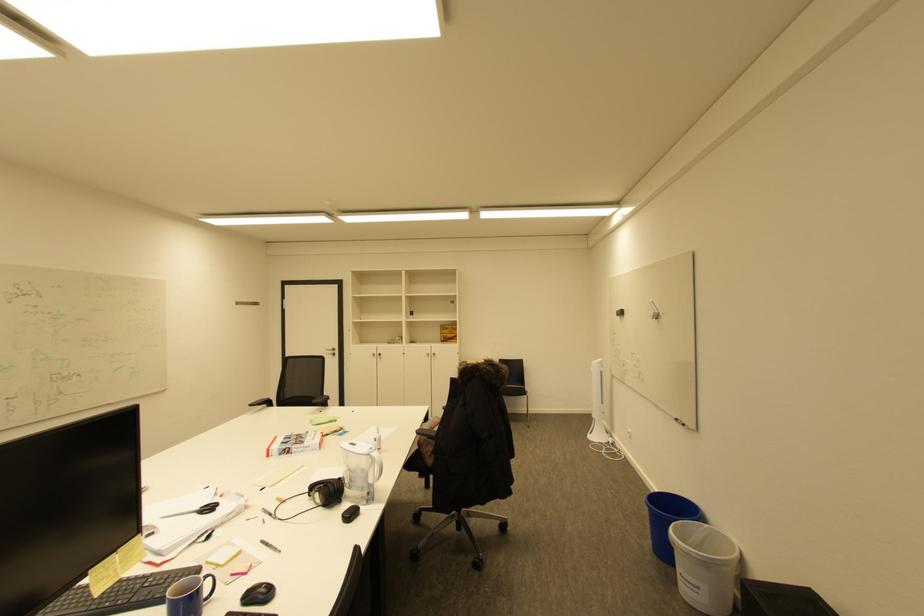
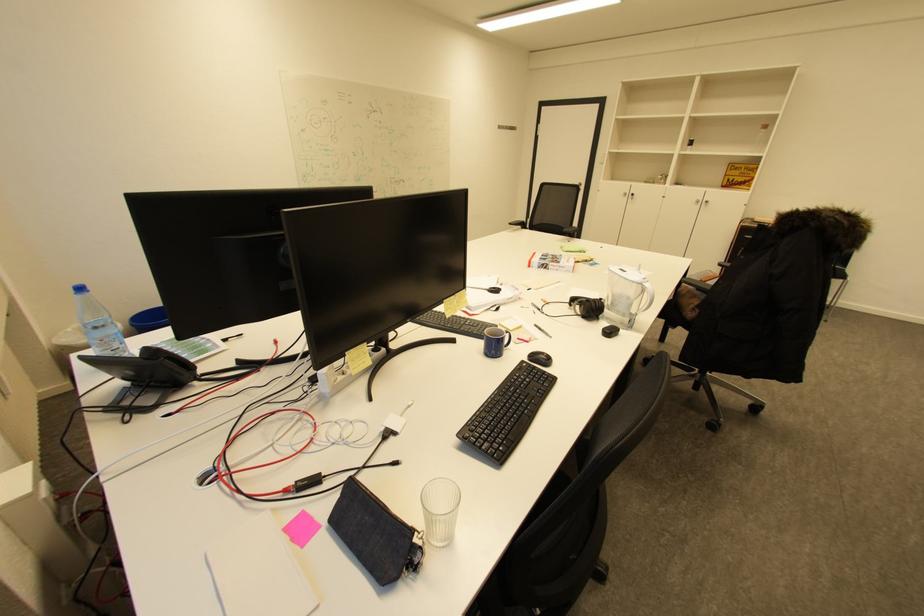
Locate, in the second image, the point that corresponds to the point at 435,440 in the first image.

(703, 293)